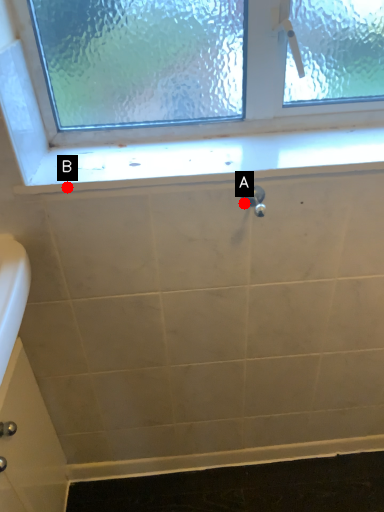
Question: Two points are circled on the image, labeled by A and B beside each circle. Among these points, which one is nearest to the camera?

Choices:
 (A) A is closer
 (B) B is closer

Answer: (B)